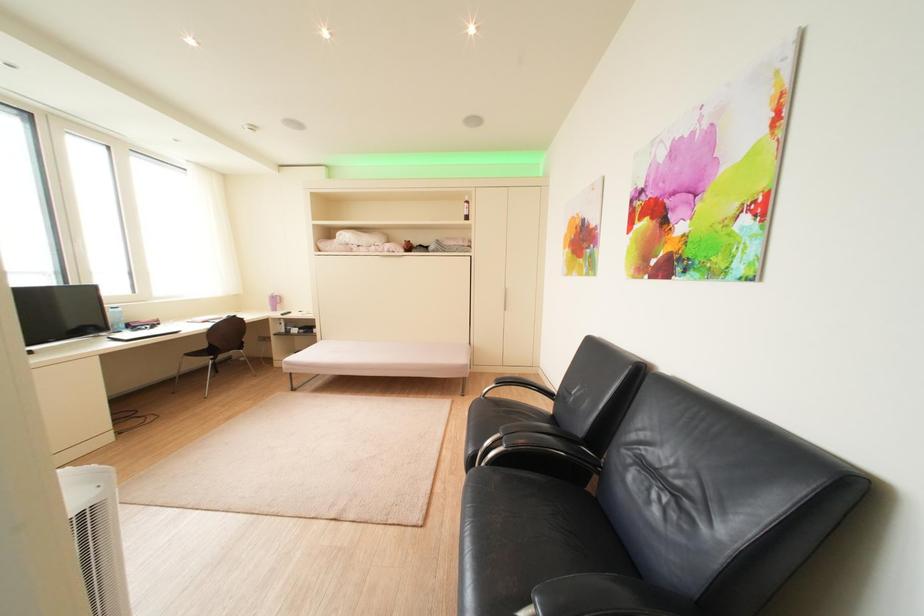
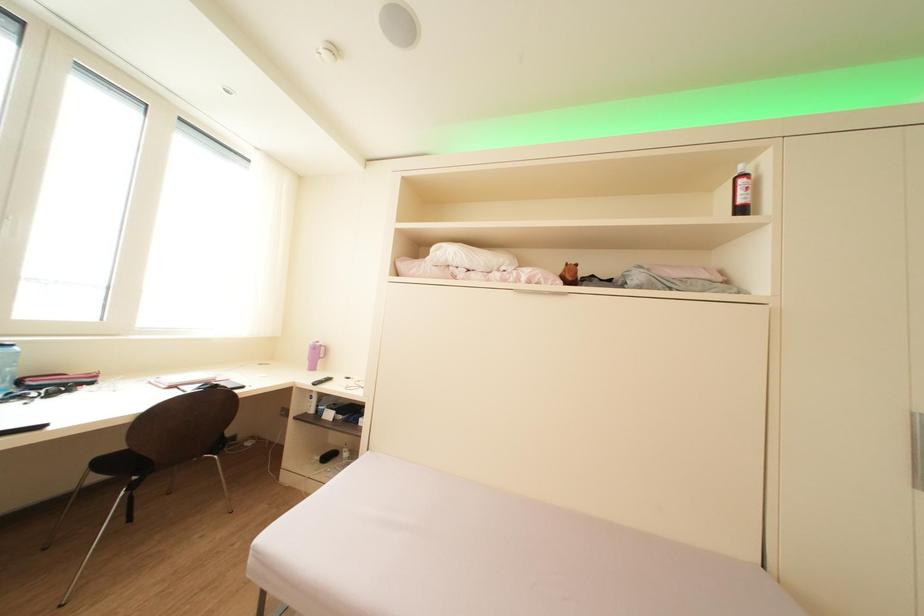
What movement of the cameraman would produce the second image?

The cameraman moved toward left, forward.